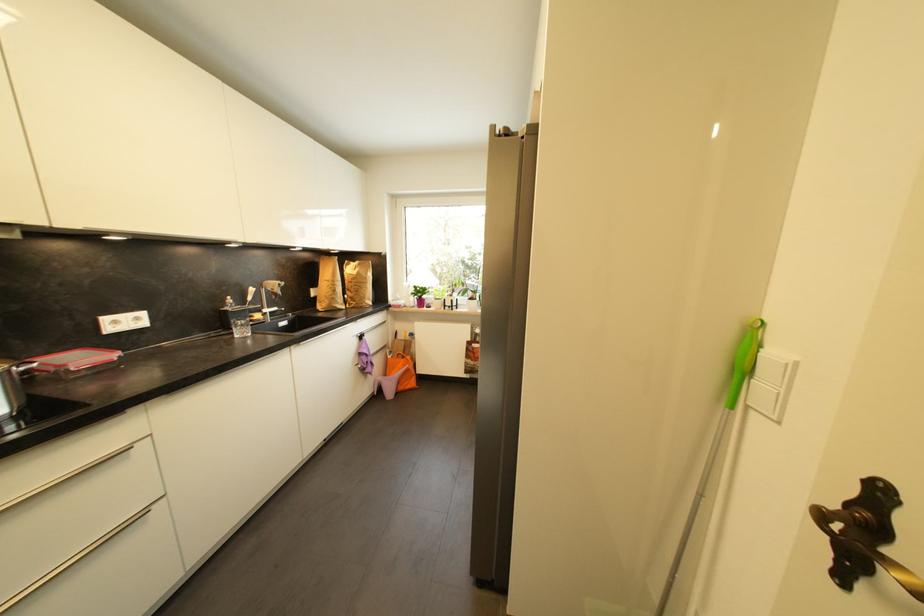
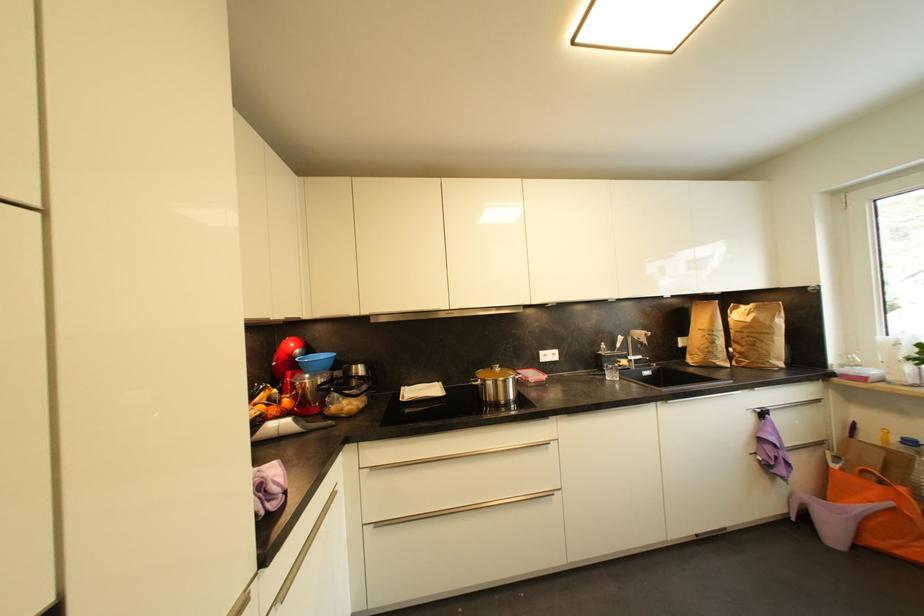
Find the pixel in the second image that matches point 358,281 in the first image.

(748, 330)